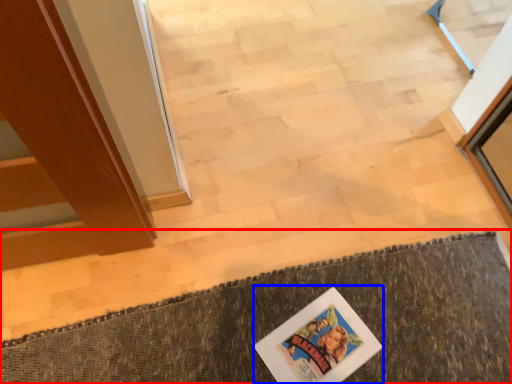
Question: Which of the following is the farthest to the observer, bath mat (highlighted by a red box) or comic book (highlighted by a blue box)?

Choices:
 (A) bath mat
 (B) comic book

Answer: (B)